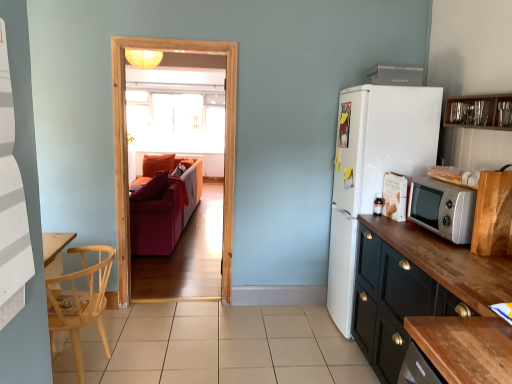
Question: Is white matte refrigerator at right wider than white plastic microwave at upper right?

Choices:
 (A) yes
 (B) no

Answer: (A)

Question: Does white matte refrigerator at right come behind white plastic microwave at upper right?

Choices:
 (A) no
 (B) yes

Answer: (B)

Question: Is white matte refrigerator at right not near white plastic microwave at upper right?

Choices:
 (A) yes
 (B) no

Answer: (B)

Question: Is white matte refrigerator at right to the right of white plastic microwave at upper right from the viewer's perspective?

Choices:
 (A) no
 (B) yes

Answer: (B)

Question: Does white matte refrigerator at right have a lesser width compared to white plastic microwave at upper right?

Choices:
 (A) yes
 (B) no

Answer: (B)

Question: Are white matte refrigerator at right and white plastic microwave at upper right beside each other?

Choices:
 (A) yes
 (B) no

Answer: (B)

Question: From a real-world perspective, does clear glass cabinet at upper right, which appears as the third cabinetry when ordered from the bottom, stand above black wood cabinet at right, which is the third cabinetry from top to bottom?

Choices:
 (A) no
 (B) yes

Answer: (B)

Question: Is clear glass cabinet at upper right, which appears as the third cabinetry when ordered from the bottom, wider than black wood cabinet at right, which appears as the first cabinetry when ordered from the bottom?

Choices:
 (A) yes
 (B) no

Answer: (B)

Question: Would you consider clear glass cabinet at upper right, which is the first cabinetry in top-to-bottom order, to be distant from black wood cabinet at right, which is the third cabinetry from top to bottom?

Choices:
 (A) yes
 (B) no

Answer: (A)

Question: Are clear glass cabinet at upper right, which appears as the third cabinetry when ordered from the bottom, and black wood cabinet at right, which is the third cabinetry from top to bottom, beside each other?

Choices:
 (A) no
 (B) yes

Answer: (A)

Question: Considering the relative positions of clear glass cabinet at upper right, which is the first cabinetry in top-to-bottom order, and black wood cabinet at right, which appears as the first cabinetry when ordered from the bottom, in the image provided, is clear glass cabinet at upper right, which is the first cabinetry in top-to-bottom order, to the left of black wood cabinet at right, which appears as the first cabinetry when ordered from the bottom, from the viewer's perspective?

Choices:
 (A) yes
 (B) no

Answer: (B)

Question: From the image's perspective, is clear glass cabinet at upper right, which appears as the third cabinetry when ordered from the bottom, located beneath black wood cabinet at right, which is the third cabinetry from top to bottom?

Choices:
 (A) no
 (B) yes

Answer: (A)

Question: Does clear glass window at center have a lesser width compared to silver metallic microwave oven at right?

Choices:
 (A) no
 (B) yes

Answer: (B)